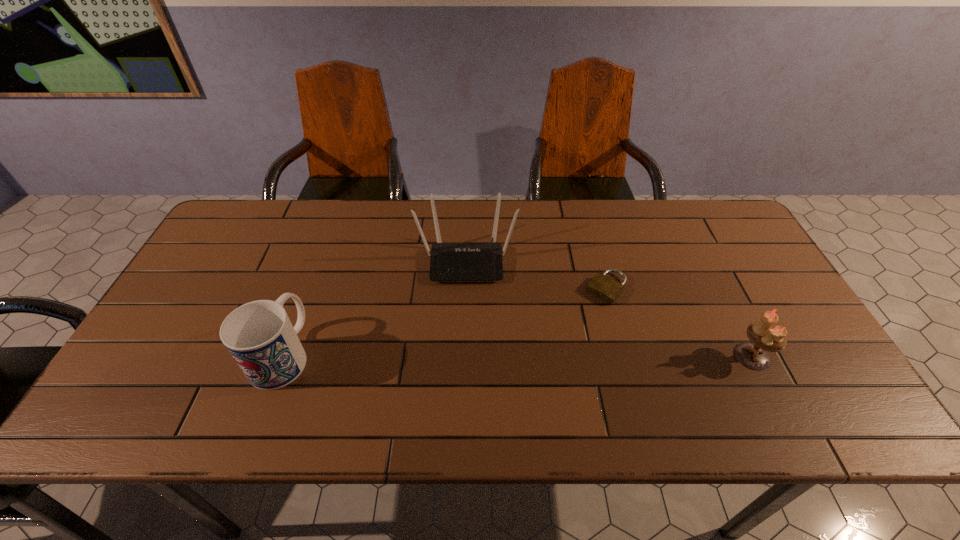
You are a GUI agent. You are given a task and a screenshot of the screen. Output one action in this format:
    pyautogui.click(x=<x>, y=<y>)
    Task: Click on the mug
    
    Given the screenshot: What is the action you would take?
    pyautogui.click(x=259, y=335)

Image resolution: width=960 pixels, height=540 pixels. Find the location of `the rightmost object`. the rightmost object is located at coordinates (764, 336).

At what (x,y) coordinates should I click in order to perform the action: click on the shortest object. Please return your answer as a coordinate pair (x, y). The image size is (960, 540). Looking at the image, I should click on (602, 286).

What are the coordinates of `the second object from right to left` in the screenshot? It's located at [x=602, y=286].

Identify the location of the third object from right to left. This screenshot has height=540, width=960. (481, 261).

Locate an element on the screen. This screenshot has height=540, width=960. free spot located on the left of the mug is located at coordinates (217, 354).

Identify the location of free point located on the back of the candle holder. This screenshot has height=540, width=960. (716, 286).

The width and height of the screenshot is (960, 540). I want to click on free spot located on the keyhole side of the padlock, so click(525, 380).

Where is `free location located on the keyhole side of the padlock`? Image resolution: width=960 pixels, height=540 pixels. free location located on the keyhole side of the padlock is located at coordinates (516, 392).

Locate an element on the screen. Image resolution: width=960 pixels, height=540 pixels. blank space located on the keyhole side of the padlock is located at coordinates (559, 342).